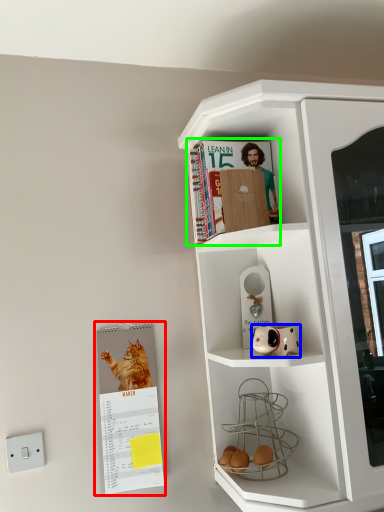
Question: Which is farther away from paperback book (highlighted by a red box)? toy (highlighted by a blue box) or magazine (highlighted by a green box)?

Choices:
 (A) toy
 (B) magazine

Answer: (B)